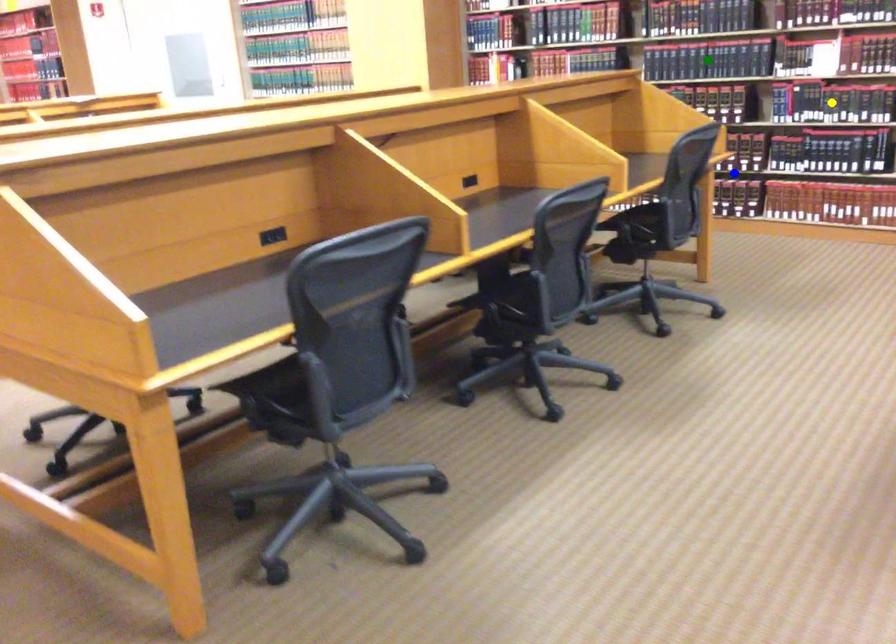
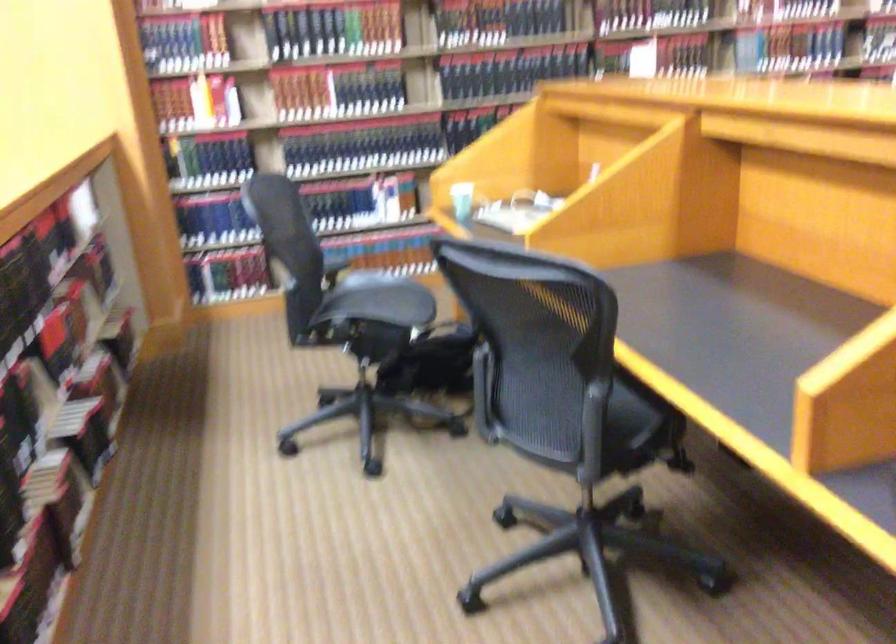
I am providing you with two images of the same scene from different viewpoints. Three points are marked in image1. Which point corresponds to a part or object that is occluded in image2?In image1, three points are marked. Which of them correspond to a part or object that is occluded in image2?Among the three points shown in image1, which one corresponds to a part or object that is no longer visible due to occlusion in image2?

Invisible in image2: yellow point, blue point, green point.